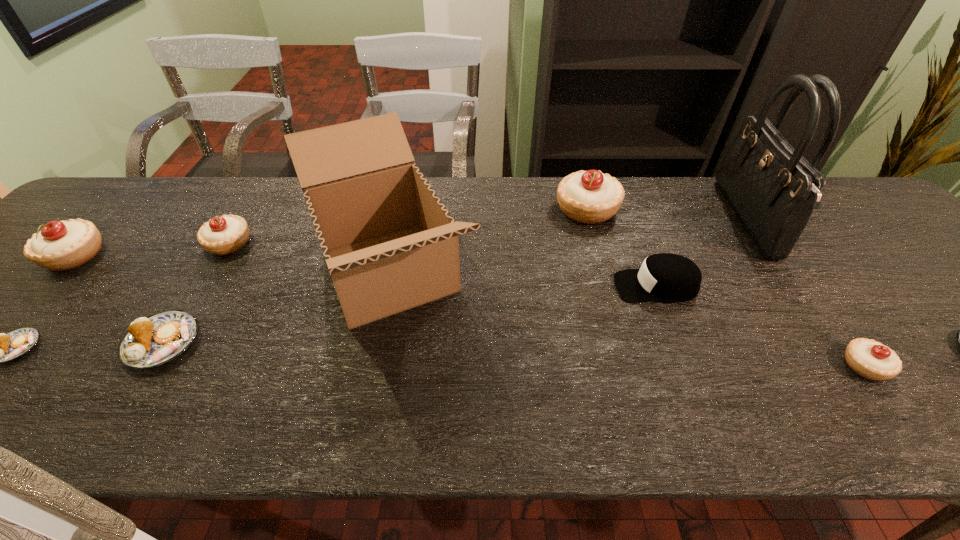
Locate an element on the screen. The image size is (960, 540). vacant space situated on the right of the fourth tallest object is located at coordinates pos(148,255).

Identify the location of blank space located 0.280m on the front of the third beige pastry from right to left. The image size is (960, 540). (164, 353).

In order to click on vacant area situated 0.100m on the front-facing side of the black cap in this screenshot , I will do `click(573, 286)`.

Where is `vacant space situated 0.280m on the front-facing side of the black cap`? The width and height of the screenshot is (960, 540). vacant space situated 0.280m on the front-facing side of the black cap is located at coordinates (497, 286).

In order to click on vacant region located on the front-facing side of the black cap in this screenshot , I will do `click(492, 286)`.

I want to click on free space located on the back of the sixth pastry from left to right, so click(x=769, y=230).

This screenshot has height=540, width=960. I want to click on free space located on the back of the biggest brown pastry, so (x=242, y=213).

At what (x,y) coordinates should I click in order to perform the action: click on handbag that is at the far edge. Please return your answer as a coordinate pair (x, y). The image size is (960, 540). Looking at the image, I should click on (773, 189).

Image resolution: width=960 pixels, height=540 pixels. I want to click on box positioned at the far edge, so click(x=390, y=245).

Image resolution: width=960 pixels, height=540 pixels. I want to click on pastry situated at the far edge, so coord(590,197).